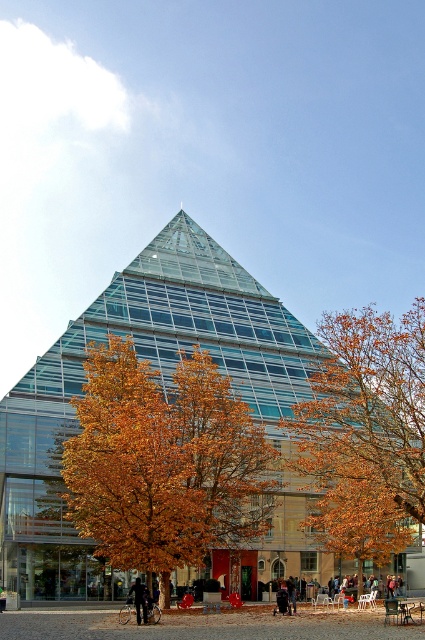
You are standing in front of the pyramid building and want to walk from the point at coordinates point (110, 321) to the point at coordinates point (133, 586). Which direction should you move relative to the pyramid building?

You should move towards the front of the pyramid building because point (110, 321) is behind point (133, 586), meaning the latter is closer to the building.

You are standing in front of the pyramid building and want to take a photo that includes both the golden leafy tree at center and the orange leafy tree at center. Which tree should you position to your left side to include both in the frame?

You should position the golden leafy tree at center to your left side because it is already to the left of the orange leafy tree at center, ensuring both are included in the frame.